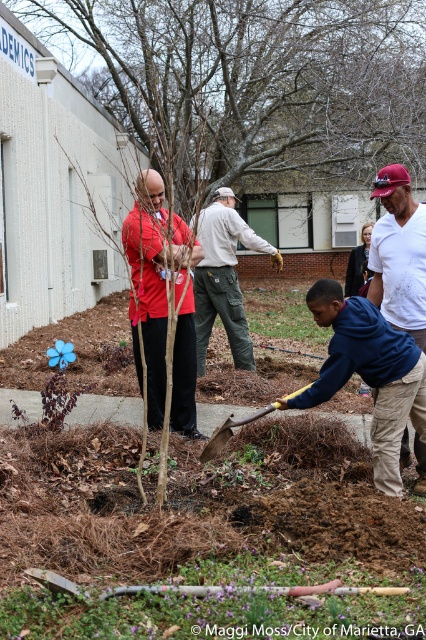
You are standing in the community garden and want to place a new flower pot. You have two options for placement at the coordinates point (144, 294) and point (236, 326). Which coordinate location is closer to you?

Point (144, 294) is closer to the viewer than point (236, 326), so you should choose that location for placing the flower pot.

You are standing in the garden and want to reach the bare branches at center. Which direction should you move relative to the white cotton shirt at center?

You should move to the right of the white cotton shirt at center to reach the bare branches at center.

You are a visitor at the garden and want to take a photo of the yellow wood shovel at center without the bare branches at center blocking the view. Is this possible?

The bare branches at center are closer to the viewer than the yellow wood shovel at center, so they would block the view of the shovel. Therefore, it is not possible to take a photo of the yellow wood shovel at center without the bare branches at center blocking the view.